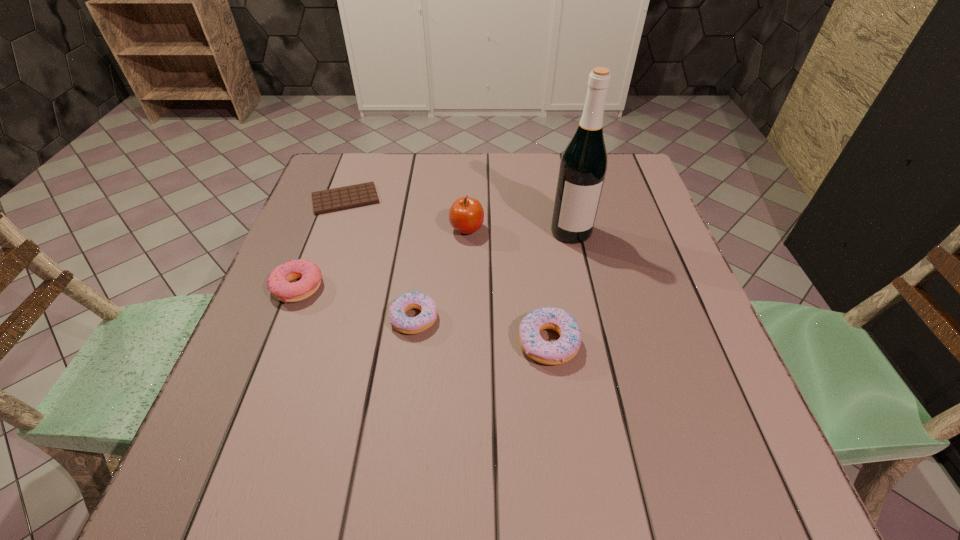
This screenshot has height=540, width=960. Identify the location of the third object from left to right. (415, 300).

Where is `the rightmost doughnut`? This screenshot has height=540, width=960. the rightmost doughnut is located at coordinates (566, 347).

Identify the location of the third tallest object. (566, 347).

This screenshot has width=960, height=540. In order to click on the fourth object from left to right in this screenshot , I will do pos(466,215).

Where is `apple`? The height and width of the screenshot is (540, 960). apple is located at coordinates pyautogui.click(x=466, y=215).

Where is `wine bottle`? The width and height of the screenshot is (960, 540). wine bottle is located at coordinates coord(583,166).

Identify the location of the shortest object. The width and height of the screenshot is (960, 540). (342, 198).

Locate an element on the screen. The height and width of the screenshot is (540, 960). the farthest object is located at coordinates (342, 198).

Find the location of a particular element. The image size is (960, 540). the leftmost doughnut is located at coordinates (278, 283).

Image resolution: width=960 pixels, height=540 pixels. Identify the location of free space located on the back of the third object from left to right. (430, 200).